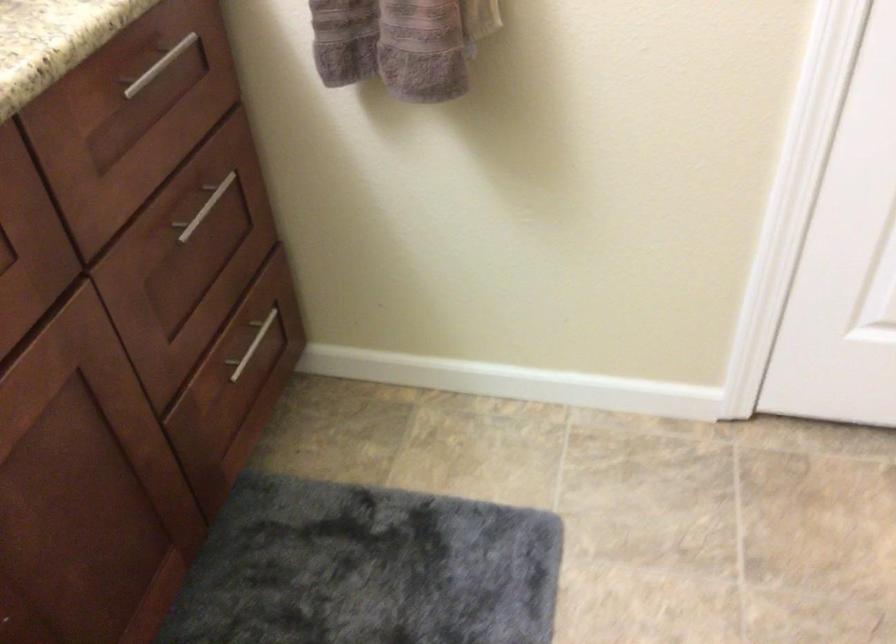
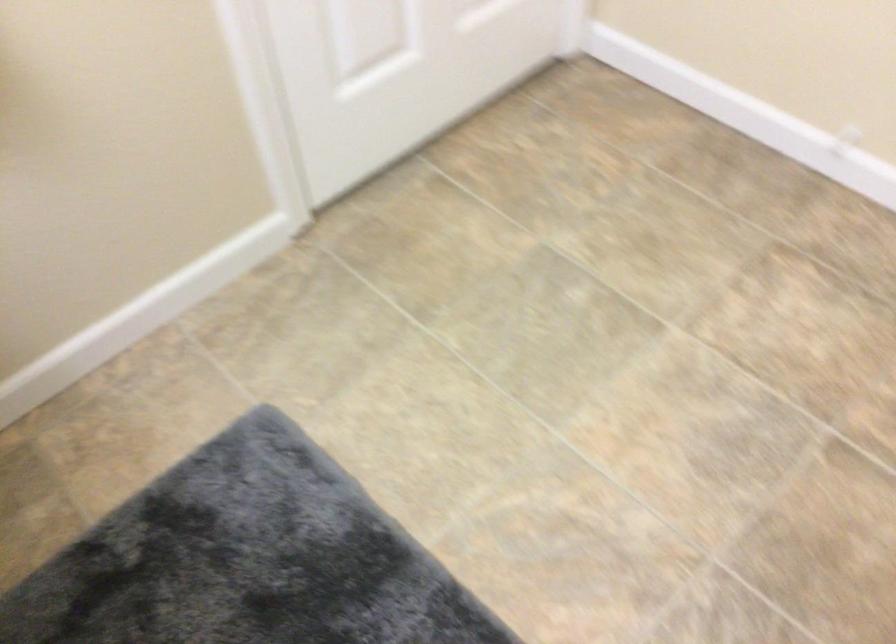
Based on the continuous images, in which direction is the camera rotating?

The camera rotated toward right-down.